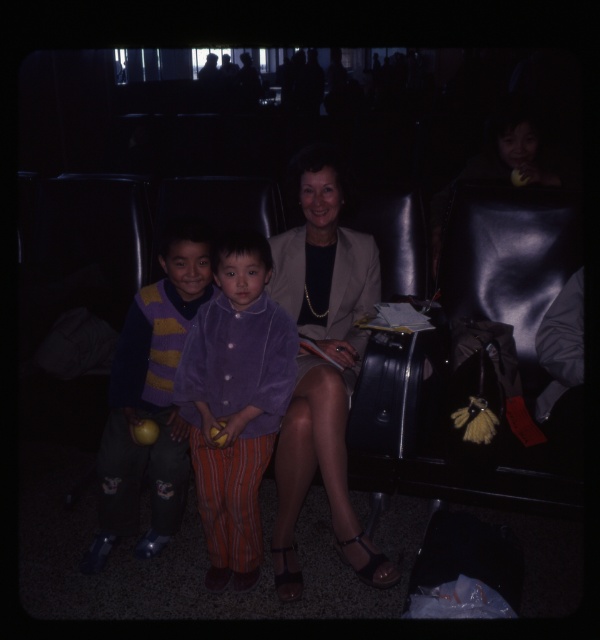
From the picture: Based on the coordinates provided, what object is located at point (322, 364) in the scene?

The point (322, 364) corresponds to the matte beige blazer at center.